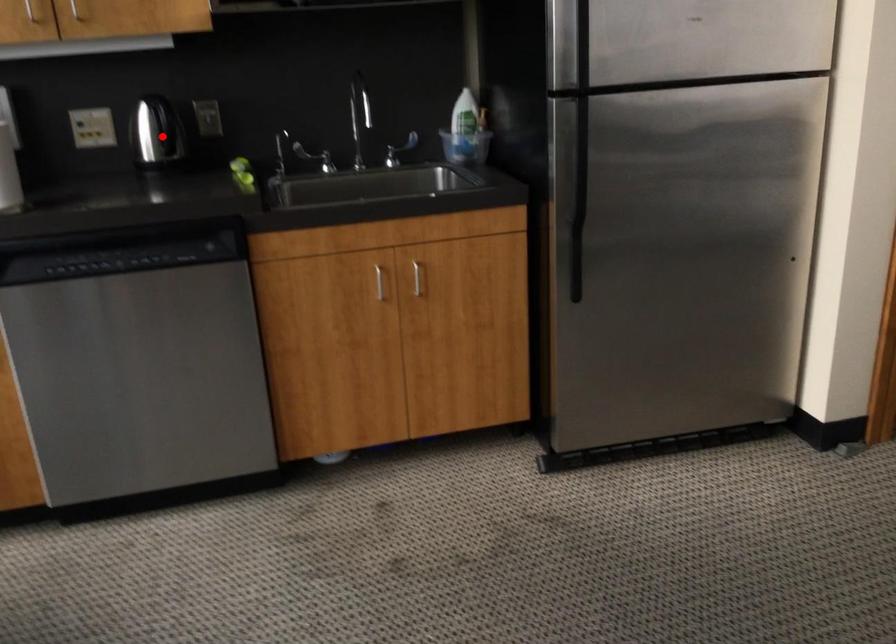
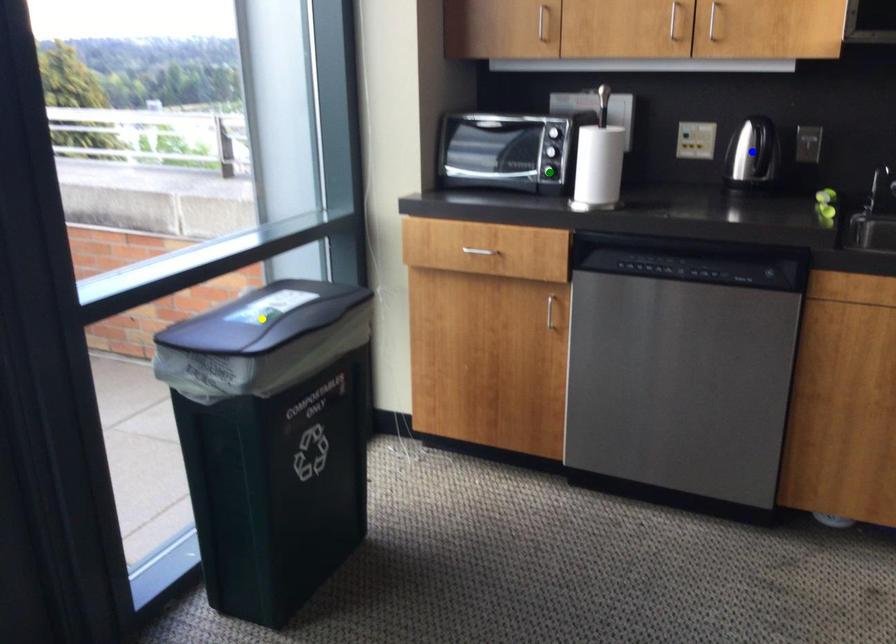
Question: I am providing you with two images of the same scene from different viewpoints. A red point is marked on the first image. You are given multiple points on the second image. Which mark in image 2 goes with the point in image 1?

Choices:
 (A) green point
 (B) yellow point
 (C) blue point

Answer: (C)